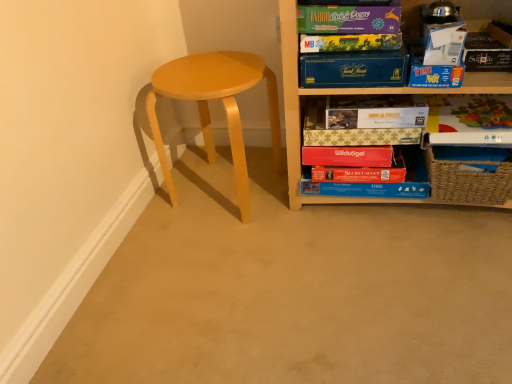
Question: Does matte cardboard book at upper center, which is counted as the 4th paperback book, starting from the top, have a lesser height compared to matte purple board game at upper right, placed as the 1th paperback book when sorted from top to bottom?

Choices:
 (A) yes
 (B) no

Answer: (B)

Question: From a real-world perspective, is matte cardboard book at upper center, which ranks as the 3th paperback book in bottom-to-top order, located higher than matte purple board game at upper right, placed as the 1th paperback book when sorted from top to bottom?

Choices:
 (A) no
 (B) yes

Answer: (A)

Question: Is matte cardboard book at upper center, which is counted as the 4th paperback book, starting from the top, thinner than matte purple board game at upper right, placed as the 1th paperback book when sorted from top to bottom?

Choices:
 (A) yes
 (B) no

Answer: (B)

Question: Is there a large distance between matte cardboard book at upper center, which ranks as the 3th paperback book in bottom-to-top order, and matte purple board game at upper right, the sixth paperback book in the bottom-to-top sequence?

Choices:
 (A) no
 (B) yes

Answer: (A)

Question: From the image's perspective, is matte cardboard book at upper center, which ranks as the 3th paperback book in bottom-to-top order, located beneath matte purple board game at upper right, the sixth paperback book in the bottom-to-top sequence?

Choices:
 (A) no
 (B) yes

Answer: (B)

Question: Is matte cardboard book at upper center, which is counted as the 4th paperback book, starting from the top, positioned beyond the bounds of matte purple board game at upper right, placed as the 1th paperback book when sorted from top to bottom?

Choices:
 (A) no
 (B) yes

Answer: (B)

Question: Does red matte paper at lower center, acting as the first paperback book starting from the bottom, contain woven brown basket at lower right?

Choices:
 (A) yes
 (B) no

Answer: (B)

Question: Considering the relative sizes of red matte paper at lower center, acting as the first paperback book starting from the bottom, and woven brown basket at lower right in the image provided, is red matte paper at lower center, acting as the first paperback book starting from the bottom, thinner than woven brown basket at lower right?

Choices:
 (A) no
 (B) yes

Answer: (B)

Question: From the image's perspective, is red matte paper at lower center, placed as the sixth paperback book when sorted from top to bottom, located above woven brown basket at lower right?

Choices:
 (A) yes
 (B) no

Answer: (B)

Question: Is red matte paper at lower center, acting as the first paperback book starting from the bottom, oriented away from woven brown basket at lower right?

Choices:
 (A) no
 (B) yes

Answer: (A)

Question: Is the position of red matte paper at lower center, acting as the first paperback book starting from the bottom, more distant than that of woven brown basket at lower right?

Choices:
 (A) yes
 (B) no

Answer: (A)

Question: Can you confirm if red matte paper at lower center, acting as the first paperback book starting from the bottom, is wider than woven brown basket at lower right?

Choices:
 (A) no
 (B) yes

Answer: (A)

Question: Considering the relative sizes of woven brown basket at lower right and matte cardboard book at upper center, which is counted as the 4th paperback book, starting from the top, in the image provided, is woven brown basket at lower right taller than matte cardboard book at upper center, which is counted as the 4th paperback book, starting from the top,?

Choices:
 (A) yes
 (B) no

Answer: (A)